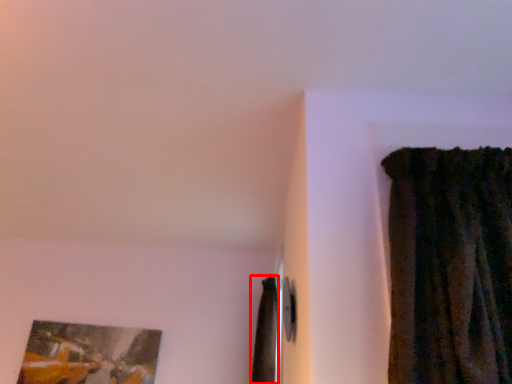
Question: From the image, what is the correct spatial relationship of curtain (annotated by the red box) in relation to picture frame?

Choices:
 (A) left
 (B) right

Answer: (B)